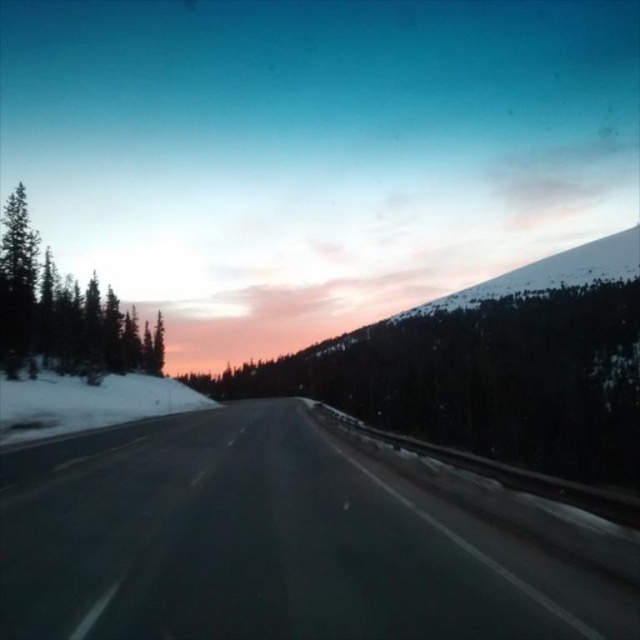
Who is positioned more to the right, black asphalt highway at center or green matte tree at left?

From the viewer's perspective, black asphalt highway at center appears more on the right side.

Which is behind, point (317, 444) or point (24, 340)?

The point (24, 340) is behind.

I want to click on black asphalt highway at center, so click(x=266, y=545).